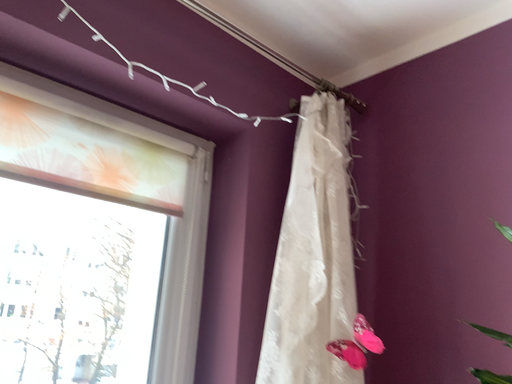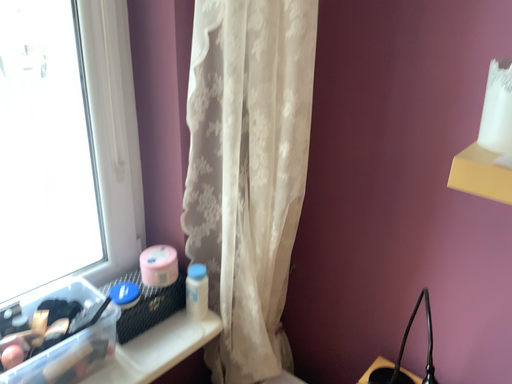
Question: Which way did the camera rotate in the video?

Choices:
 (A) rotated left
 (B) rotated right

Answer: (B)